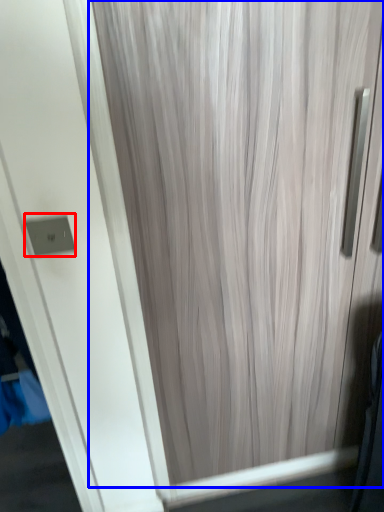
Question: Which object appears closest to the camera in this image, electric outlet (highlighted by a red box) or curtain (highlighted by a blue box)?

Choices:
 (A) electric outlet
 (B) curtain

Answer: (B)